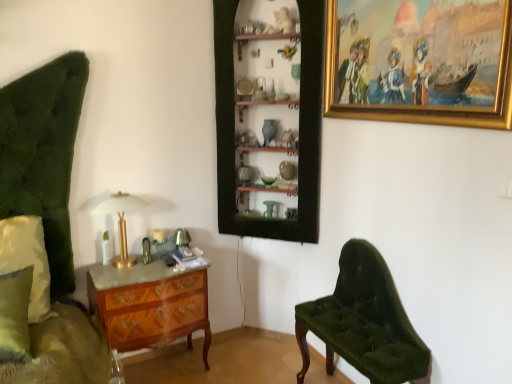
Question: Does green fabric pillow at left have a greater height compared to wooden marquetry chest of drawers at lower left?

Choices:
 (A) yes
 (B) no

Answer: (B)

Question: Is the depth of green fabric pillow at left greater than that of wooden marquetry chest of drawers at lower left?

Choices:
 (A) no
 (B) yes

Answer: (A)

Question: Is green fabric pillow at left thinner than wooden marquetry chest of drawers at lower left?

Choices:
 (A) no
 (B) yes

Answer: (B)

Question: Can you confirm if green fabric pillow at left is positioned to the right of wooden marquetry chest of drawers at lower left?

Choices:
 (A) yes
 (B) no

Answer: (B)

Question: From a real-world perspective, is green fabric pillow at left under wooden marquetry chest of drawers at lower left?

Choices:
 (A) yes
 (B) no

Answer: (B)

Question: Is green fabric pillow at left to the left of wooden marquetry chest of drawers at lower left from the viewer's perspective?

Choices:
 (A) no
 (B) yes

Answer: (B)

Question: Can we say velvet green bench at lower right lies outside wooden shelves at center?

Choices:
 (A) yes
 (B) no

Answer: (A)

Question: From the image's perspective, is velvet green bench at lower right on wooden shelves at center?

Choices:
 (A) yes
 (B) no

Answer: (B)

Question: Is velvet green bench at lower right directly adjacent to wooden shelves at center?

Choices:
 (A) no
 (B) yes

Answer: (A)

Question: Is velvet green bench at lower right at the right side of wooden shelves at center?

Choices:
 (A) no
 (B) yes

Answer: (B)

Question: Is the position of velvet green bench at lower right more distant than that of wooden shelves at center?

Choices:
 (A) yes
 (B) no

Answer: (B)

Question: Is velvet green bench at lower right looking in the opposite direction of wooden shelves at center?

Choices:
 (A) yes
 (B) no

Answer: (B)

Question: Can you confirm if wooden shelves at center is positioned to the left of gold-framed painting at upper right?

Choices:
 (A) no
 (B) yes

Answer: (B)